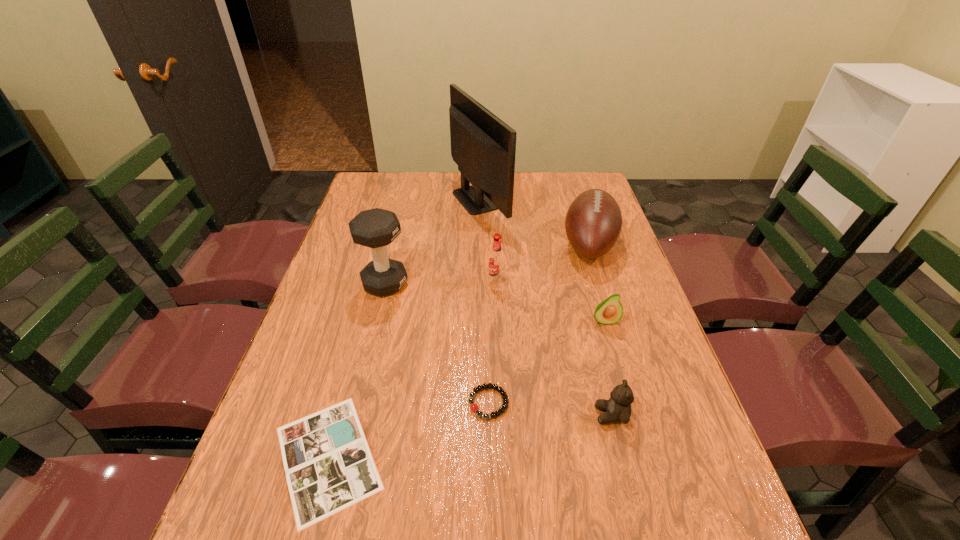
Where is `free spot located on the back of the football (American)`? free spot located on the back of the football (American) is located at coordinates (571, 187).

At what (x,y) coordinates should I click in order to perform the action: click on vacant space situated on the right of the root beer. Please return your answer as a coordinate pair (x, y). Looking at the image, I should click on (573, 281).

Locate an element on the screen. The image size is (960, 540). free space located on the cut side of the avocado is located at coordinates (615, 355).

This screenshot has width=960, height=540. Find the location of `blank area located 0.140m on the face of the teddy bear`. blank area located 0.140m on the face of the teddy bear is located at coordinates (530, 415).

Identify the location of vacant space situated 0.250m on the face of the teddy bear. The image size is (960, 540). (478, 415).

You are a GUI agent. You are given a task and a screenshot of the screen. Output one action in this format:
    pyautogui.click(x=<x>, y=<y>)
    Task: Click on the vacant space situated on the face of the teddy bear
    This screenshot has height=540, width=960.
    Given the screenshot: What is the action you would take?
    pyautogui.click(x=525, y=415)

Find the location of a particular element. The width and height of the screenshot is (960, 540). free region located 0.200m on the back of the bracelet is located at coordinates (487, 321).

Identify the location of vacant space located on the back of the book. The width and height of the screenshot is (960, 540). (371, 298).

The image size is (960, 540). Find the location of `object located in the far edge section of the desktop`. object located in the far edge section of the desktop is located at coordinates (483, 146).

I want to click on dumbbell that is at the left edge, so click(376, 228).